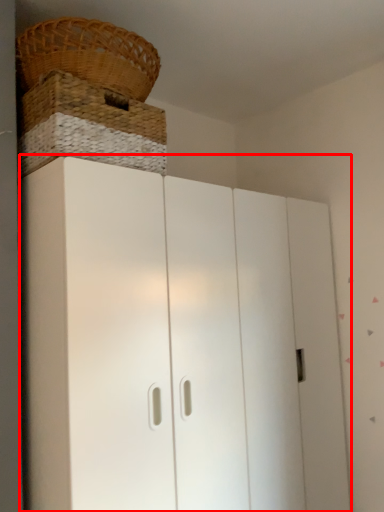
Question: In this image, where is cupboard (annotated by the red box) located relative to basket?

Choices:
 (A) left
 (B) right

Answer: (B)